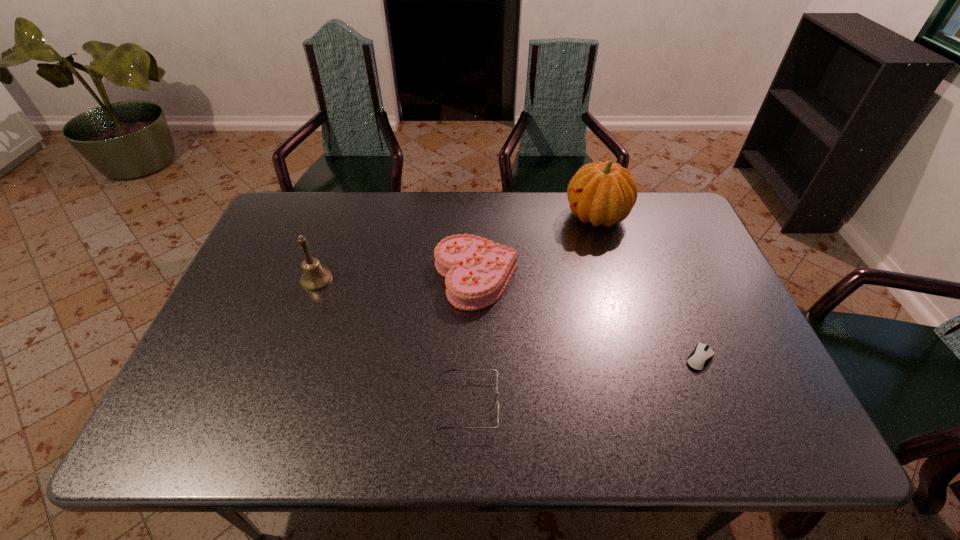
The width and height of the screenshot is (960, 540). Identify the location of free spot between the cake and the spectacles. (472, 340).

I want to click on unoccupied position between the spectacles and the cake, so click(472, 340).

The width and height of the screenshot is (960, 540). In order to click on free point between the mouse and the farthest object in this screenshot , I will do `click(648, 287)`.

Choose which object is the fourth nearest neighbor to the shortest object. Please provide its 2D coordinates. Your answer should be formatted as a tuple, i.e. [(x, y)], where the tuple contains the x and y coordinates of a point satisfying the conditions above.

[(314, 277)]

Find the location of `the closest object to the second object from right to left`. the closest object to the second object from right to left is located at coordinates (477, 271).

At what (x,y) coordinates should I click in order to perform the action: click on vacant position in the image that satisfies the following two spatial constraints: 1. on the back side of the fourth farthest object; 2. on the carved face of the pumpkin. Please return your answer as a coordinate pair (x, y). The height and width of the screenshot is (540, 960). Looking at the image, I should click on (641, 216).

At what (x,y) coordinates should I click in order to perform the action: click on free region that satisfies the following two spatial constraints: 1. on the front side of the fourth farthest object; 2. on the front-facing side of the spectacles. Please return your answer as a coordinate pair (x, y). The image size is (960, 540). Looking at the image, I should click on (718, 403).

Where is `vacant space that satisfies the following two spatial constraints: 1. on the carved face of the mouse; 2. on the left side of the second object from right to left`? The height and width of the screenshot is (540, 960). vacant space that satisfies the following two spatial constraints: 1. on the carved face of the mouse; 2. on the left side of the second object from right to left is located at coordinates (638, 358).

Image resolution: width=960 pixels, height=540 pixels. I want to click on free space that satisfies the following two spatial constraints: 1. on the back side of the leftmost object; 2. on the left side of the cake, so click(317, 278).